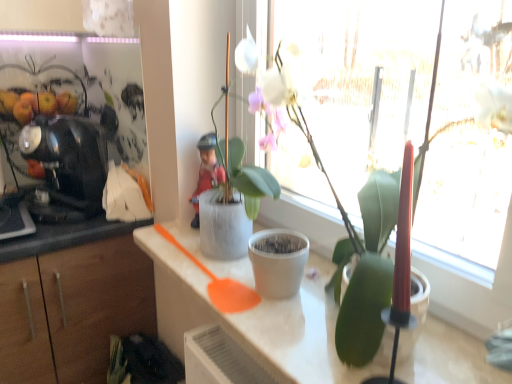
Question: Does black glossy coffee machine at left have a smaller size compared to white matte pot at center, the first houseplant viewed from the back?

Choices:
 (A) yes
 (B) no

Answer: (A)

Question: From a real-world perspective, does black glossy coffee machine at left sit lower than white matte pot at center, arranged as the second houseplant when viewed from the front?

Choices:
 (A) no
 (B) yes

Answer: (B)

Question: Does black glossy coffee machine at left have a lesser height compared to white matte pot at center, the first houseplant viewed from the back?

Choices:
 (A) no
 (B) yes

Answer: (B)

Question: Is the depth of black glossy coffee machine at left greater than that of white matte pot at center, arranged as the second houseplant when viewed from the front?

Choices:
 (A) no
 (B) yes

Answer: (B)

Question: Is black glossy coffee machine at left positioned before white matte pot at center, the first houseplant viewed from the back?

Choices:
 (A) no
 (B) yes

Answer: (A)

Question: From the image's perspective, is white matte flowerpot at center positioned above or below black glossy coffee machine at left?

Choices:
 (A) below
 (B) above

Answer: (A)

Question: In the image, is white matte flowerpot at center positioned in front of or behind black glossy coffee machine at left?

Choices:
 (A) behind
 (B) front

Answer: (B)

Question: Is point (271, 253) closer or farther from the camera than point (69, 190)?

Choices:
 (A) farther
 (B) closer

Answer: (B)

Question: Looking at their shapes, would you say white matte flowerpot at center is wider or thinner than black glossy coffee machine at left?

Choices:
 (A) wide
 (B) thin

Answer: (B)

Question: From a real-world perspective, relative to white matte countertop at center, is black glossy coffee machine at left vertically above or below?

Choices:
 (A) below
 (B) above

Answer: (B)

Question: Considering the positions of black glossy coffee machine at left and white matte countertop at center in the image, is black glossy coffee machine at left wider or thinner than white matte countertop at center?

Choices:
 (A) thin
 (B) wide

Answer: (A)

Question: Would you say black glossy coffee machine at left is inside or outside white matte countertop at center?

Choices:
 (A) outside
 (B) inside

Answer: (A)

Question: Is black glossy coffee machine at left taller or shorter than white matte countertop at center?

Choices:
 (A) tall
 (B) short

Answer: (A)

Question: Is black glossy coffee machine at left in front of or behind white matte flowerpot at center in the image?

Choices:
 (A) behind
 (B) front

Answer: (A)

Question: Considering the positions of black glossy coffee machine at left and white matte flowerpot at center in the image, is black glossy coffee machine at left taller or shorter than white matte flowerpot at center?

Choices:
 (A) tall
 (B) short

Answer: (A)